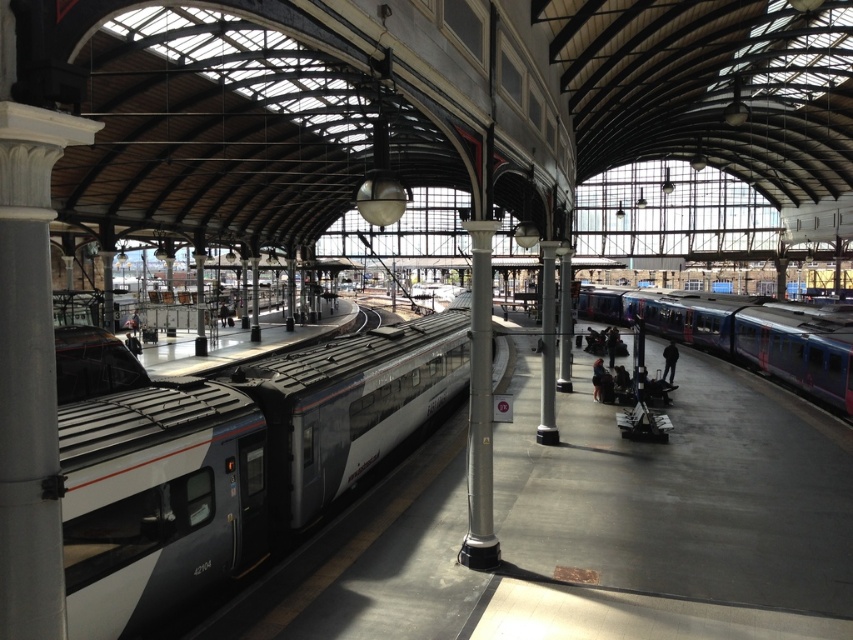
You are a photographer standing at the center of the train station. You want to take a photo of both the metallic blue train at right and the dark blue jeans at center. Which object will appear wider in the photo?

The dark blue jeans at center will appear wider in the photo because the metallic blue train at right has a lesser width compared to dark blue jeans at center.

You are standing at the train station and see a person wearing dark blue jeans at center and dark blue jacket at center. Which clothing item is closer to you?

The dark blue jeans at center are closer to you than the dark blue jacket at center.